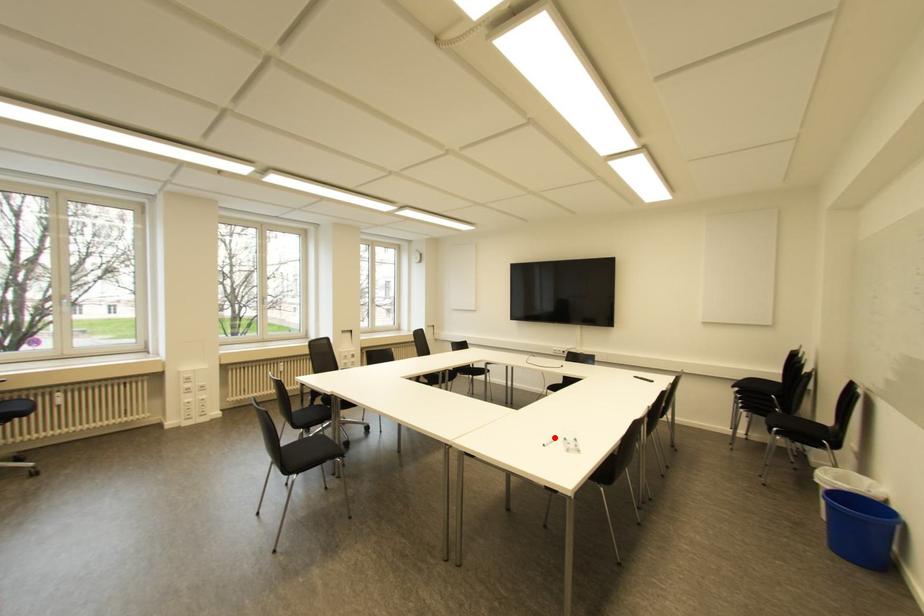
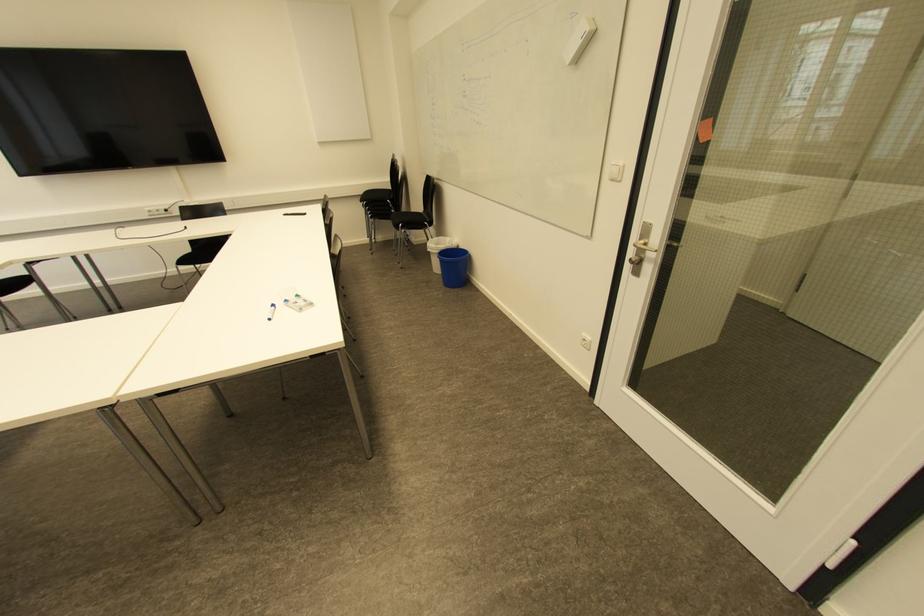
Where in the second image is the point corresponding to the highlighted location from the first image?

(273, 306)